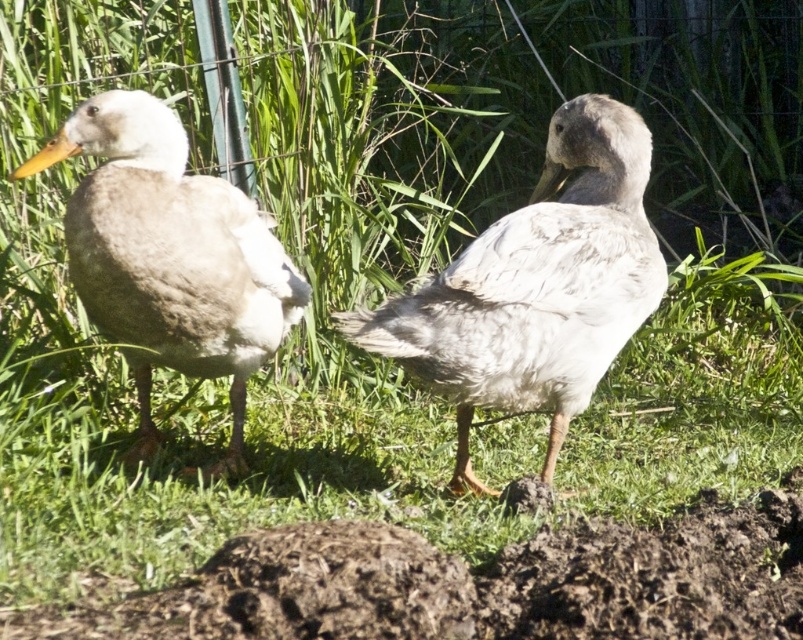
Question: Is white fluffy duck at center closer to camera compared to white matte duck at left?

Choices:
 (A) no
 (B) yes

Answer: (A)

Question: In this image, where is brown earthy mud at lower center located relative to white matte duck at left?

Choices:
 (A) above
 (B) below

Answer: (B)

Question: Which of the following is the closest to the observer?

Choices:
 (A) brown earthy mud at lower center
 (B) white fluffy duck at center

Answer: (A)

Question: Which of these objects is positioned farthest from the white matte duck at left?

Choices:
 (A) brown earthy mud at lower center
 (B) white fluffy duck at center

Answer: (A)

Question: Which of the following is the farthest from the observer?

Choices:
 (A) white matte duck at left
 (B) brown earthy mud at lower center
 (C) white fluffy duck at center

Answer: (C)

Question: Is white fluffy duck at center wider than white matte duck at left?

Choices:
 (A) yes
 (B) no

Answer: (A)